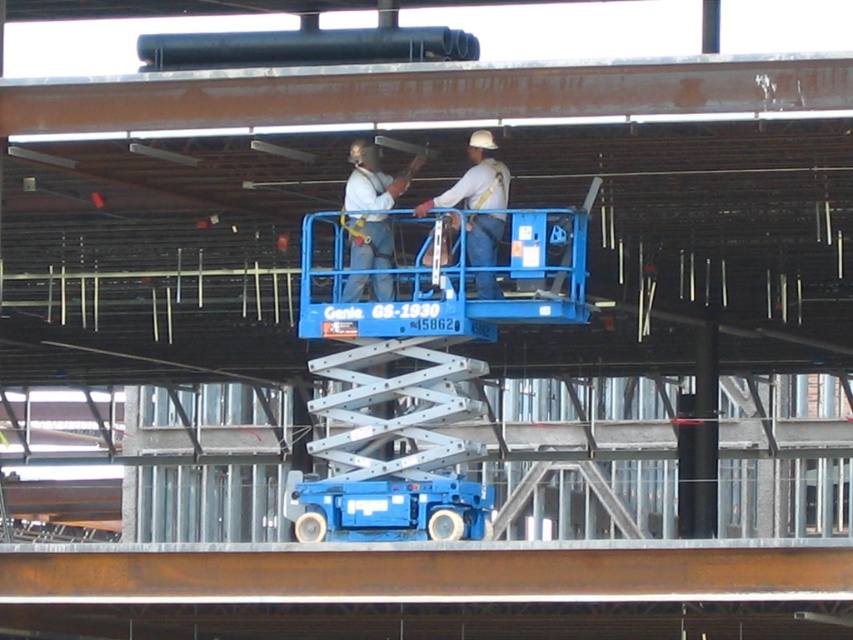
Consider the image. Who is positioned more to the right, white matte safety helmet at center or white hard hat at center?

From the viewer's perspective, white hard hat at center appears more on the right side.

Which of these two, white matte safety helmet at center or white hard hat at center, stands taller?

white hard hat at center

Between point (387, 266) and point (482, 154), which one is positioned in front?

Point (387, 266) is in front.

The width and height of the screenshot is (853, 640). I want to click on white matte safety helmet at center, so click(372, 204).